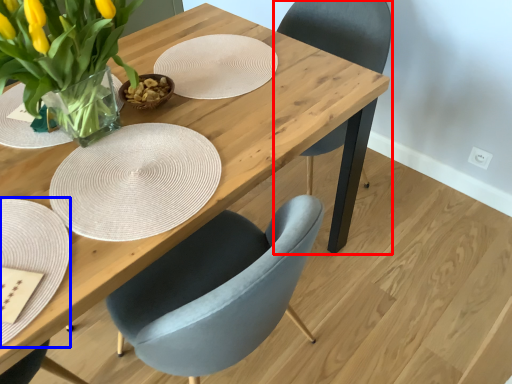
Question: Which object is closer to the camera taking this photo, chair (highlighted by a red box) or plate (highlighted by a blue box)?

Choices:
 (A) chair
 (B) plate

Answer: (B)